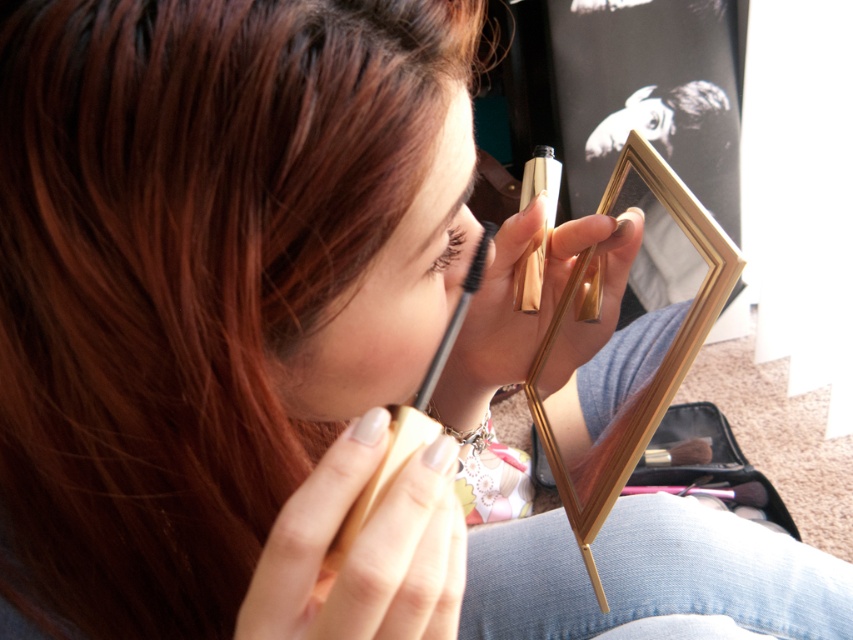
Is matte black eyeliner at center positioned at the back of brown wooden brush at lower center?

No, matte black eyeliner at center is closer to the viewer.

Between matte black eyeliner at center and brown wooden brush at lower center, which one has less height?

With less height is brown wooden brush at lower center.

This screenshot has height=640, width=853. Identify the location of matte black eyeliner at center. coord(390,296).

Where is `matte black eyeliner at center`? This screenshot has height=640, width=853. matte black eyeliner at center is located at coordinates (390, 296).

Between black matte brush at center and brown matte eyebrow at upper center, which one is positioned lower?

black matte brush at center is lower down.

Who is taller, black matte brush at center or brown matte eyebrow at upper center?

With more height is black matte brush at center.

Describe the element at coordinates (407, 420) in the screenshot. This screenshot has width=853, height=640. I see `black matte brush at center` at that location.

The width and height of the screenshot is (853, 640). I want to click on black matte brush at center, so 407,420.

Does matte black eyeliner at center have a lesser height compared to brown matte eyebrow at upper center?

Incorrect, matte black eyeliner at center's height does not fall short of brown matte eyebrow at upper center's.

Consider the image. Between matte black eyeliner at center and brown matte eyebrow at upper center, which one has more height?

With more height is matte black eyeliner at center.

Between point (457, 268) and point (459, 240), which one is positioned in front?

Positioned in front is point (459, 240).

Image resolution: width=853 pixels, height=640 pixels. I want to click on matte black eyeliner at center, so click(x=390, y=296).